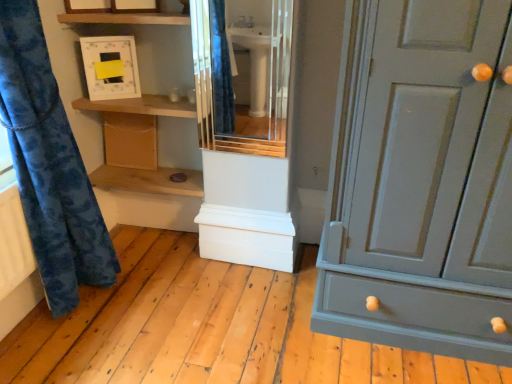
Question: From the image's perspective, is matte white cabinet at center positioned above or below blue fabric curtain at left?

Choices:
 (A) above
 (B) below

Answer: (A)

Question: Considering the positions of matte white cabinet at center and blue fabric curtain at left in the image, is matte white cabinet at center taller or shorter than blue fabric curtain at left?

Choices:
 (A) short
 (B) tall

Answer: (A)

Question: Considering the real-world distances, which object is farthest from the matte white cabinet at center?

Choices:
 (A) wooden shelf at center, acting as the first shelf starting from the bottom
 (B) wooden shelf at upper center, the 2th shelf ordered from the bottom
 (C) matte white medicine cabinet at upper center
 (D) wooden cabinet at lower left
 (E) matte gray cabinet at right

Answer: (E)

Question: Which object is positioned farthest from the wooden shelf at upper center, which is the first shelf in top-to-bottom order?

Choices:
 (A) blue fabric curtain at left
 (B) matte white medicine cabinet at upper center
 (C) wooden shelf at center, acting as the first shelf starting from the bottom
 (D) wooden cabinet at lower left
 (E) matte white cabinet at center

Answer: (E)